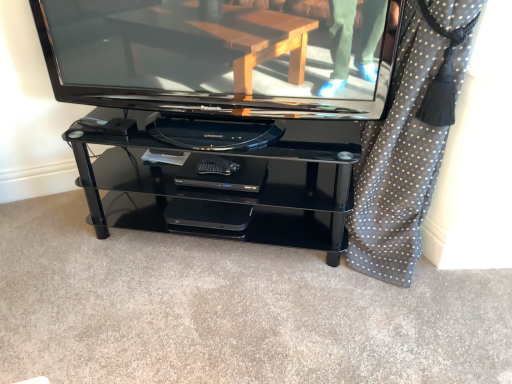
Locate an element on the screen. This screenshot has height=384, width=512. free space underneath polka dot fabric at right (from a real-world perspective) is located at coordinates (444, 277).